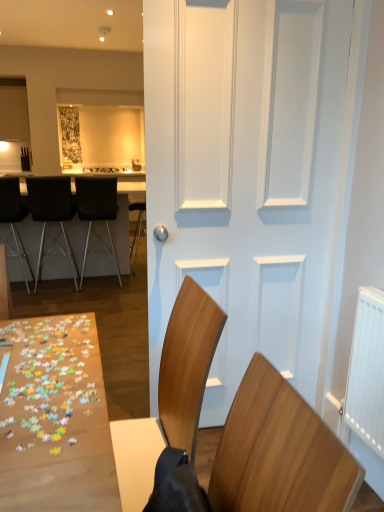
Question: From a real-world perspective, is white plastic radiator at right physically below black leather chair at center, which is the first chair from back to front?

Choices:
 (A) yes
 (B) no

Answer: (A)

Question: From a real-world perspective, is white plastic radiator at right on top of black leather chair at center, which is counted as the 4th chair, starting from the front?

Choices:
 (A) yes
 (B) no

Answer: (B)

Question: Would you say white plastic radiator at right is a long distance from black leather chair at center, acting as the second chair starting from the right?

Choices:
 (A) no
 (B) yes

Answer: (B)

Question: Is the position of white plastic radiator at right less distant than that of black leather chair at center, acting as the second chair starting from the right?

Choices:
 (A) yes
 (B) no

Answer: (A)

Question: Considering the relative sizes of white plastic radiator at right and black leather chair at center, which is the first chair from back to front, in the image provided, is white plastic radiator at right smaller than black leather chair at center, which is the first chair from back to front,?

Choices:
 (A) yes
 (B) no

Answer: (A)

Question: Considering the relative sizes of white plastic radiator at right and black leather chair at center, which is the first chair from back to front, in the image provided, is white plastic radiator at right thinner than black leather chair at center, which is the first chair from back to front,?

Choices:
 (A) no
 (B) yes

Answer: (B)

Question: Is black leather chair at center, which is counted as the third chair, starting from the left, further to camera compared to black metal bar stool at left, which is the 3th chair in back-to-front order?

Choices:
 (A) no
 (B) yes

Answer: (B)

Question: Is there a large distance between black leather chair at center, which is the first chair from back to front, and black metal bar stool at left, which is counted as the 1th chair, starting from the left?

Choices:
 (A) yes
 (B) no

Answer: (B)

Question: Is black leather chair at center, which is the first chair from back to front, aimed at black metal bar stool at left, which is counted as the 1th chair, starting from the left?

Choices:
 (A) yes
 (B) no

Answer: (B)

Question: From the image's perspective, does black leather chair at center, which is counted as the third chair, starting from the left, appear lower than black metal bar stool at left, the 2th chair when ordered from front to back?

Choices:
 (A) no
 (B) yes

Answer: (A)

Question: Is black leather chair at center, which is the first chair from back to front, smaller than black metal bar stool at left, which is counted as the 1th chair, starting from the left?

Choices:
 (A) no
 (B) yes

Answer: (A)

Question: Is black leather chair at center, which is the first chair from back to front, positioned beyond the bounds of black metal bar stool at left, which is counted as the 1th chair, starting from the left?

Choices:
 (A) yes
 (B) no

Answer: (A)

Question: Can you confirm if wooden chair at lower right, the first chair in the right-to-left sequence, is positioned to the left of black leather chair at left, the third chair viewed from the front?

Choices:
 (A) no
 (B) yes

Answer: (A)